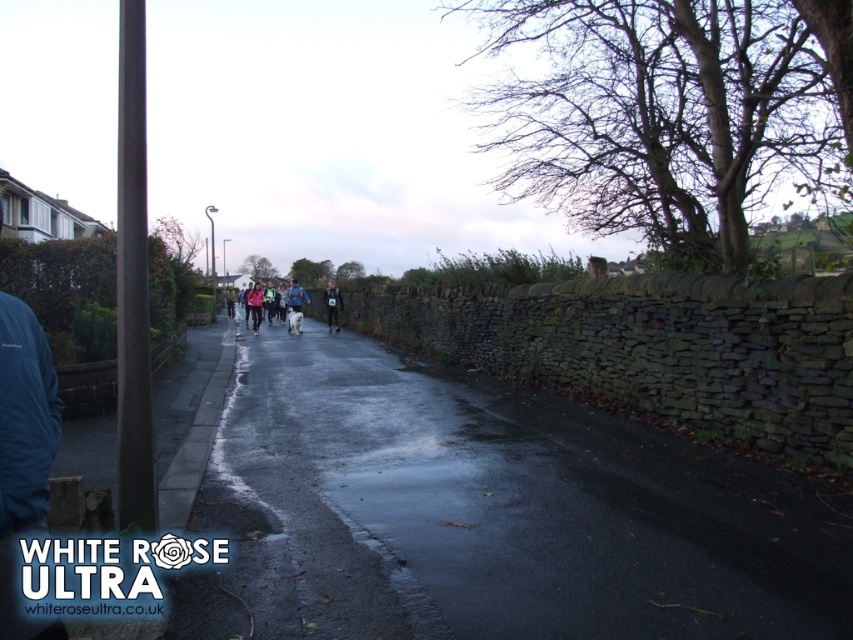
You are standing on the rural road scene and want to walk from point A to point B. The coordinates for point A are point A at point (252, 326) and point B are point B at point (329, 314). Which point is closer to you, point A or point B?

Point A at point (252, 326) is closer to you than point B at point (329, 314).

You are a photographer positioned on the sidewalk next to the lamppost. You want to capture a photo that includes both the white fabric jacket at center and the dark blue running suit at center. Which of the two will appear larger in the photo?

The white fabric jacket at center will appear larger in the photo because it is taller than the dark blue running suit at center.

You are a photographer standing at the center of the road. You want to capture a photo of the blue softshell jacket at lower left. Based on the coordinates provided, in which direction should you move to position yourself directly in front of it?

The blue softshell jacket at lower left is located at coordinates point (24,454). Since the jacket is at lower left, you should move towards the lower left direction to position yourself directly in front of it.